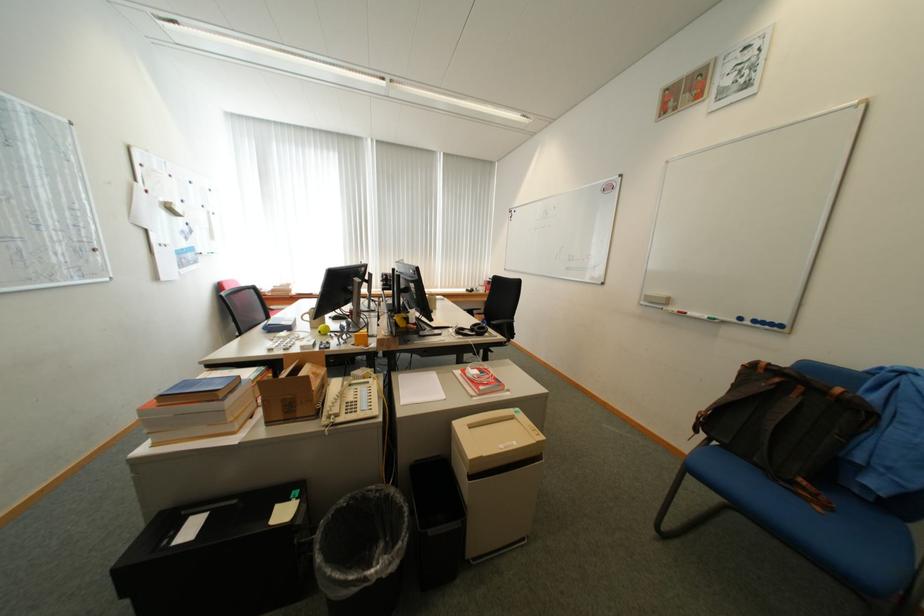
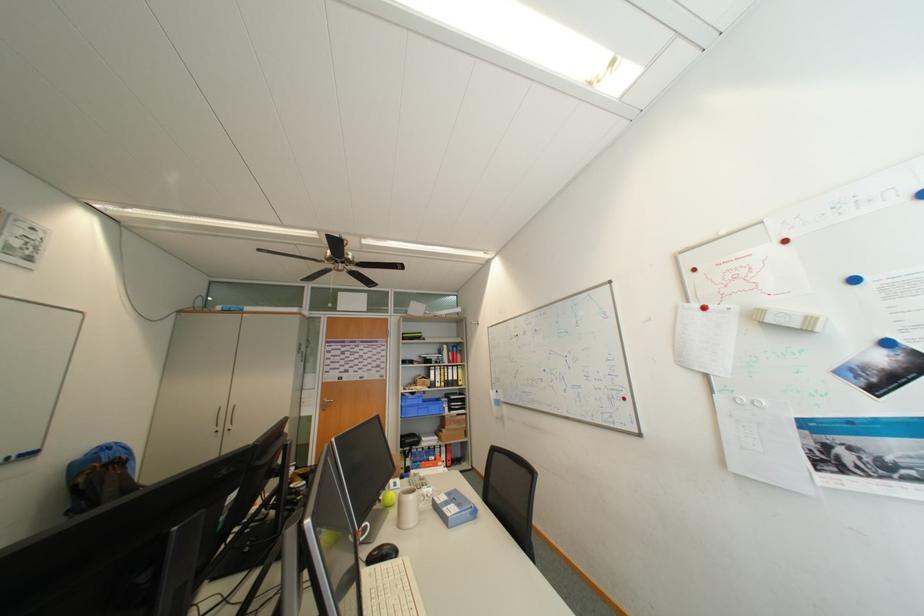
Find the pixel in the second image that matches pixel 188 211 in the first image.

(777, 322)